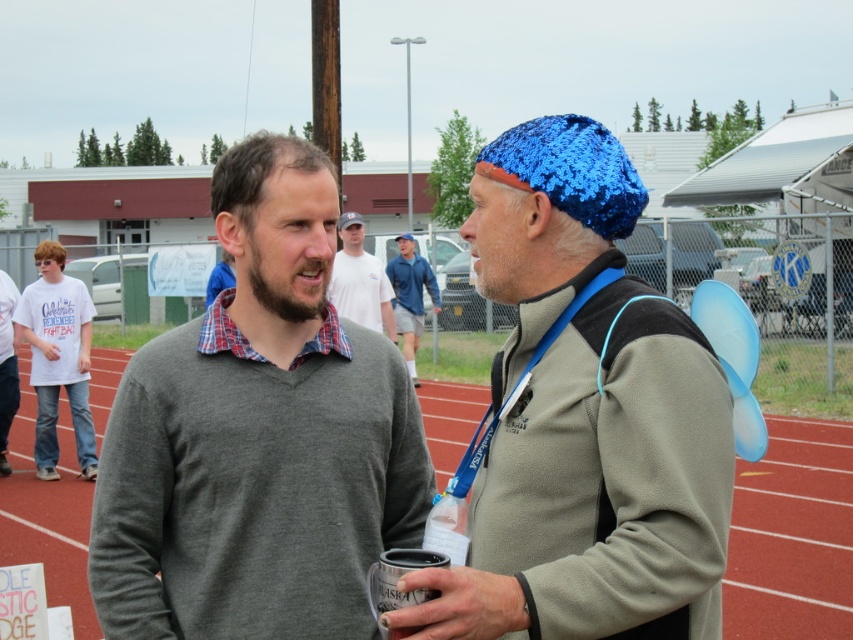
You are organizing a charity event and need to place a blue knitted hat at center and a translucent plastic cup at center on a shelf. Which item should you place first if you want to ensure both fit without overlapping?

The blue knitted hat at center might be wider than the translucent plastic cup at center, so you should place the wider item first to ensure both fit without overlapping.

You are standing at point (412, 237) and want to walk to the running track behind point (521, 428). Is the path between these two points clear?

Point (521, 428) is in front of point (412, 237), so the path between them might be blocked by objects in front of point (412, 237). Check for any obstacles before proceeding.

You are a photographer trying to capture both the blue sequined beanie at center and the blue knitted hat at center in a single frame. Since you want to emphasize the smaller one, which hat should you focus on and why?

The blue sequined beanie at center has a lesser width compared to the blue knitted hat at center, so you should focus on the blue sequined beanie at center to emphasize its smaller size.